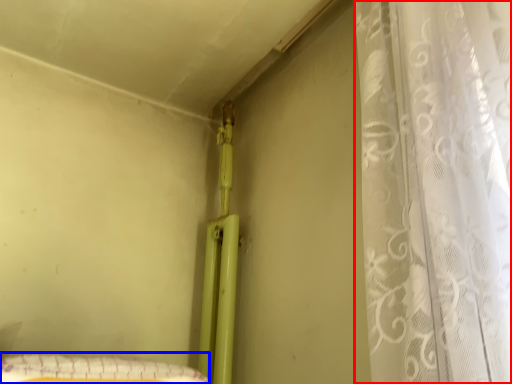
Question: Which object is closer to the camera taking this photo, curtain (highlighted by a red box) or sheet (highlighted by a blue box)?

Choices:
 (A) curtain
 (B) sheet

Answer: (A)